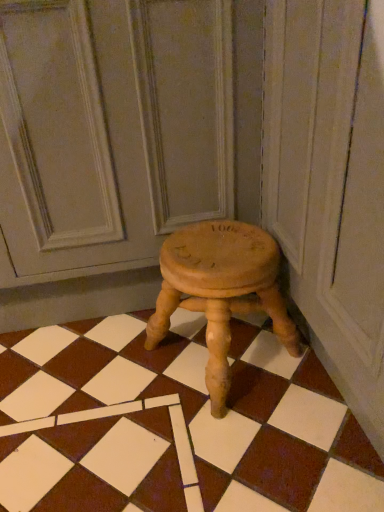
Question: Looking at their shapes, would you say wooden stool at center is wider or thinner than wooden stool at center?

Choices:
 (A) wide
 (B) thin

Answer: (A)

Question: Looking at the image, does wooden stool at center seem bigger or smaller compared to wooden stool at center?

Choices:
 (A) big
 (B) small

Answer: (A)

Question: Which of these objects is positioned closest to the natural wood stool at center?

Choices:
 (A) wooden stool at center
 (B) wooden stool at center

Answer: (B)

Question: Which is nearer to the wooden stool at center?

Choices:
 (A) natural wood stool at center
 (B) wooden stool at center

Answer: (B)